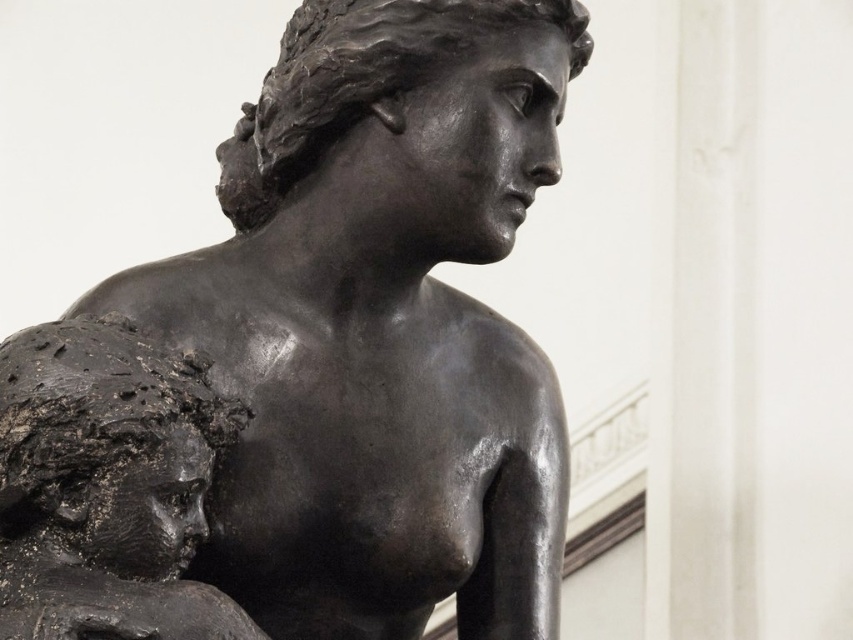
Who is taller, matte black statue at center or matte black bust at left?

With more height is matte black statue at center.

Which is in front, point (450, 136) or point (126, 435)?

Point (126, 435)

The height and width of the screenshot is (640, 853). Identify the location of matte black statue at center. (312, 364).